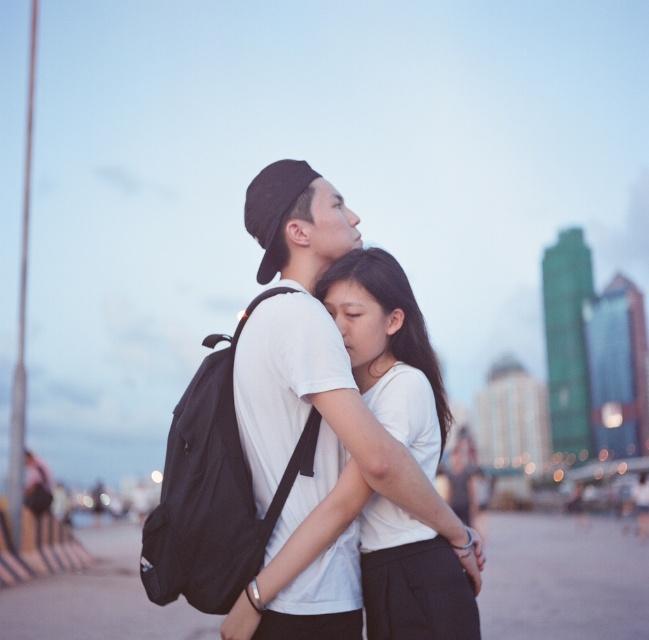
Is white matte shirt at center below black matte backpack at center?

Incorrect, white matte shirt at center is not positioned below black matte backpack at center.

Is white matte shirt at center closer to the viewer compared to black matte backpack at center?

No.

Where is `white matte shirt at center`? This screenshot has height=640, width=649. white matte shirt at center is located at coordinates (378, 566).

Image resolution: width=649 pixels, height=640 pixels. In order to click on white matte shirt at center in this screenshot , I will do `click(378, 566)`.